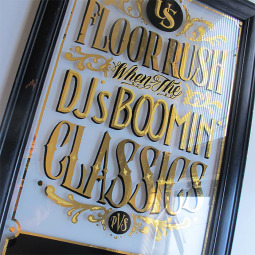
This screenshot has width=255, height=255. In order to click on glass in this screenshot , I will do `click(25, 211)`.